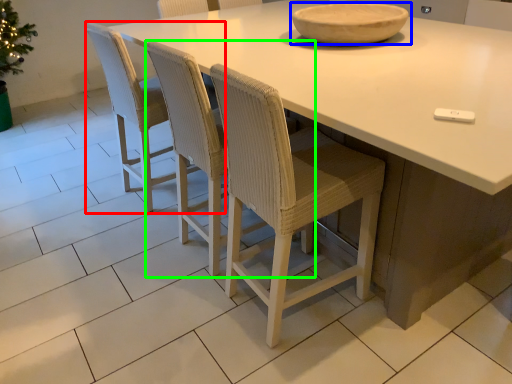
Question: Which object is the closest to the chair (highlighted by a red box)? Choose among these: bowl (highlighted by a blue box) or chair (highlighted by a green box).

Choices:
 (A) bowl
 (B) chair

Answer: (B)